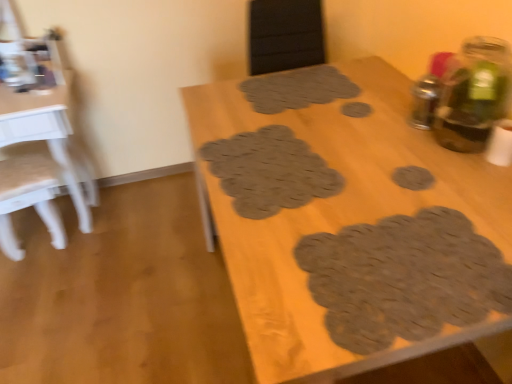
The width and height of the screenshot is (512, 384). Identify the location of vacant space that's between green glass bottle at upper right, acting as the 1th bottle starting from the front, and brown textured mat at bottom right, which is the fifth footprint from back to front. (425, 193).